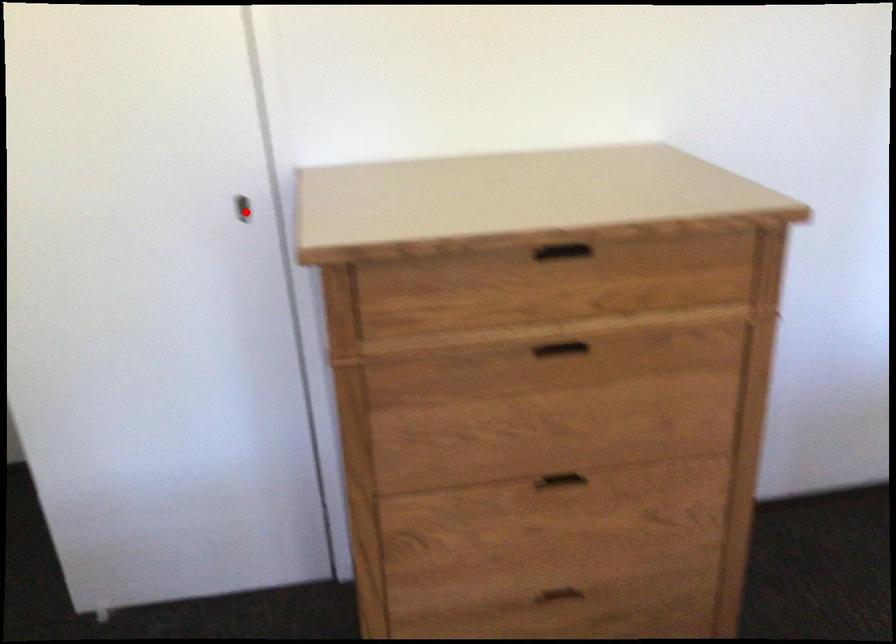
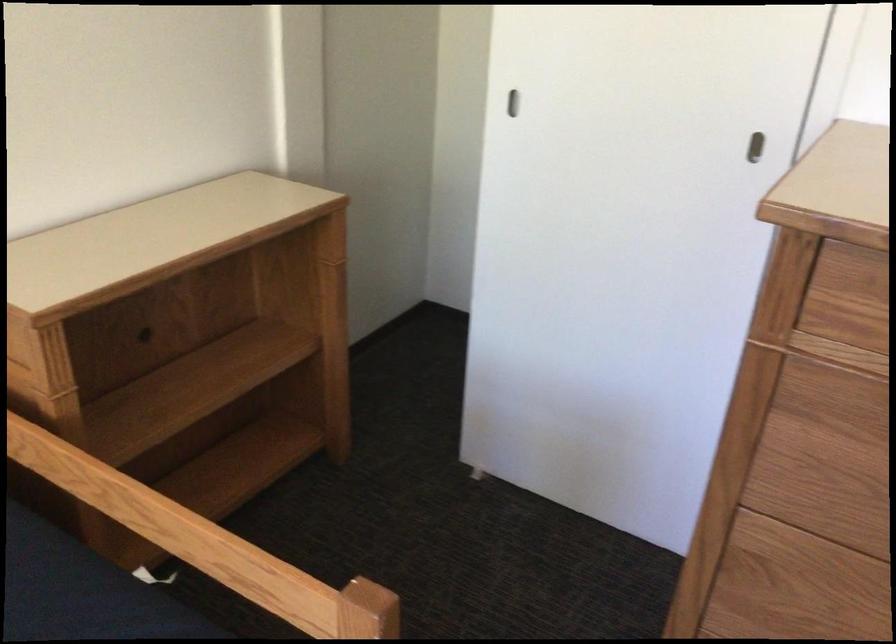
Find the pixel in the second image that matches the highlighted location in the first image.

(754, 147)